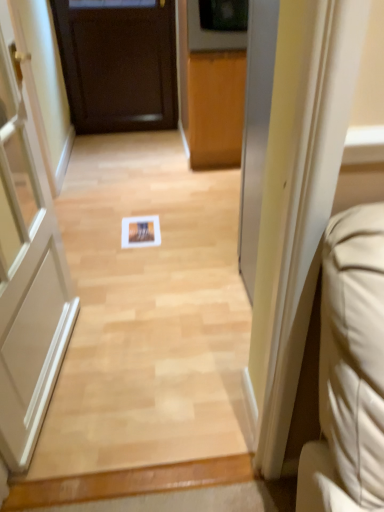
Question: Does white matte door at left, the first door positioned from the front, have a lesser width compared to dark wood door at center, the second door viewed from the front?

Choices:
 (A) yes
 (B) no

Answer: (B)

Question: Is the position of white matte door at left, the first door positioned from the front, less distant than that of dark wood door at center, the second door viewed from the front?

Choices:
 (A) no
 (B) yes

Answer: (B)

Question: Is the depth of white matte door at left, the 2th door viewed from the back, greater than that of dark wood door at center, the 1th door viewed from the top?

Choices:
 (A) yes
 (B) no

Answer: (B)

Question: Can you confirm if white matte door at left, the first door positioned from the front, is smaller than dark wood door at center, the 1th door viewed from the top?

Choices:
 (A) yes
 (B) no

Answer: (B)

Question: Is white matte door at left, the first door positioned from the front, bigger than dark wood door at center, the 1th door viewed from the back?

Choices:
 (A) yes
 (B) no

Answer: (A)

Question: Are dark wood door at center, which appears as the second door when ordered from the bottom, and white matte door at left, which is counted as the first door, starting from the bottom, making contact?

Choices:
 (A) no
 (B) yes

Answer: (A)

Question: From the image's perspective, does dark wood door at center, the 1th door viewed from the top, appear higher than white matte door at left, the first door positioned from the front?

Choices:
 (A) no
 (B) yes

Answer: (B)

Question: Does dark wood door at center, which appears as the second door when ordered from the bottom, have a greater height compared to white matte door at left, positioned as the 2th door in top-to-bottom order?

Choices:
 (A) no
 (B) yes

Answer: (A)

Question: Can we say dark wood door at center, the second door viewed from the front, lies outside white matte door at left, the first door positioned from the front?

Choices:
 (A) no
 (B) yes

Answer: (B)

Question: Is the position of dark wood door at center, the 1th door viewed from the back, less distant than that of white matte door at left, the 2th door viewed from the back?

Choices:
 (A) no
 (B) yes

Answer: (A)

Question: Can you confirm if dark wood door at center, the 1th door viewed from the back, is wider than white matte door at left, positioned as the 2th door in top-to-bottom order?

Choices:
 (A) no
 (B) yes

Answer: (A)

Question: Is dark wood door at center, the second door viewed from the front, inside the boundaries of white matte door at left, positioned as the 2th door in top-to-bottom order, or outside?

Choices:
 (A) inside
 (B) outside

Answer: (B)